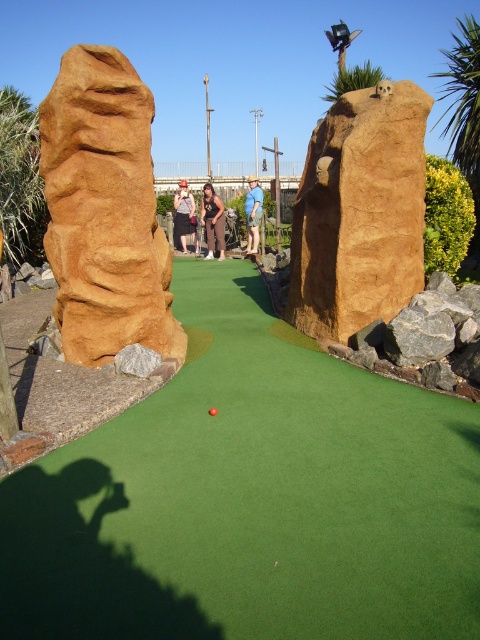
Question: Which point appears farthest from the camera in this image?

Choices:
 (A) (88, 324)
 (B) (215, 406)
 (C) (300, 310)

Answer: (C)

Question: Is brown textured rock at upper center to the right of blue denim shorts at center from the viewer's perspective?

Choices:
 (A) yes
 (B) no

Answer: (A)

Question: Is blue denim shorts at center wider than smooth red golf ball at center?

Choices:
 (A) yes
 (B) no

Answer: (A)

Question: Does brown textured rock at center come behind matte black shirt at center?

Choices:
 (A) yes
 (B) no

Answer: (B)

Question: Which is farther from the blue denim shorts at center?

Choices:
 (A) brown leather pants at center
 (B) brown textured rock at upper center
 (C) green artificial turf at center

Answer: (C)

Question: Which point is closer to the camera taking this photo?

Choices:
 (A) (381, 170)
 (B) (91, 170)
 (C) (303, 436)
 (D) (176, 241)

Answer: (C)